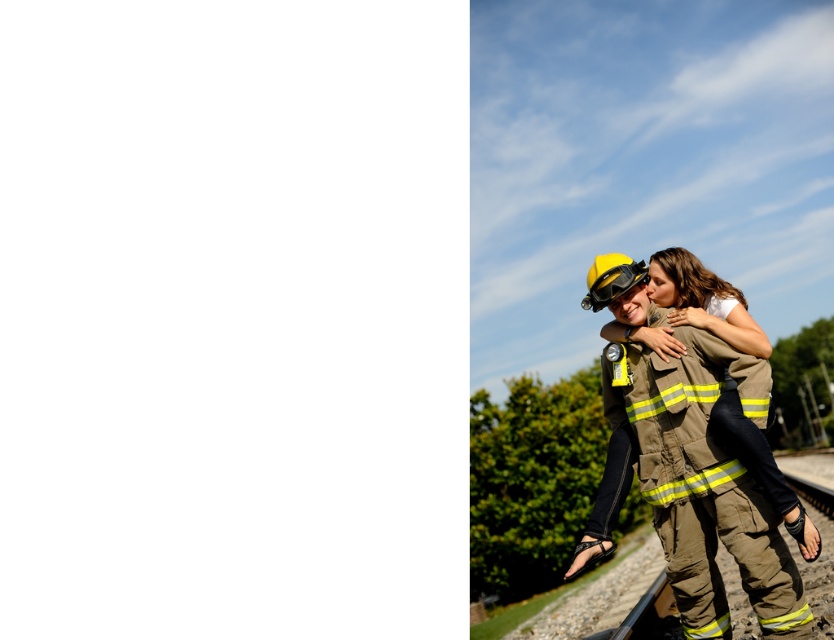
Question: In this image, where is brown fireman uniform at right located relative to yellow matte safety goggles at center?

Choices:
 (A) left
 (B) right

Answer: (B)

Question: Is the position of brown fireman uniform at right more distant than that of yellow matte safety goggles at center?

Choices:
 (A) yes
 (B) no

Answer: (B)

Question: Among these objects, which one is nearest to the camera?

Choices:
 (A) brown fireman uniform at right
 (B) yellow matte safety goggles at center

Answer: (A)

Question: Does brown fireman uniform at right appear on the left side of yellow matte safety goggles at center?

Choices:
 (A) yes
 (B) no

Answer: (B)